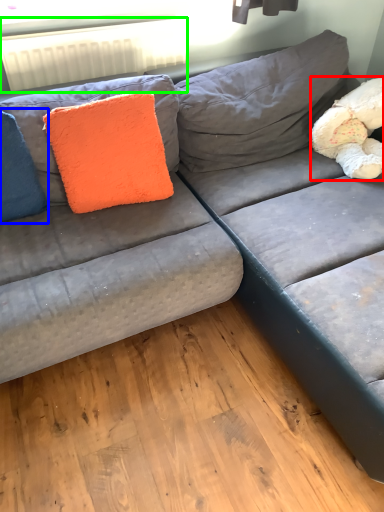
Question: Based on their relative distances, which object is nearer to teddy (highlighted by a red box)? Choose from pillow (highlighted by a blue box) and radiator (highlighted by a green box).

Choices:
 (A) pillow
 (B) radiator

Answer: (B)